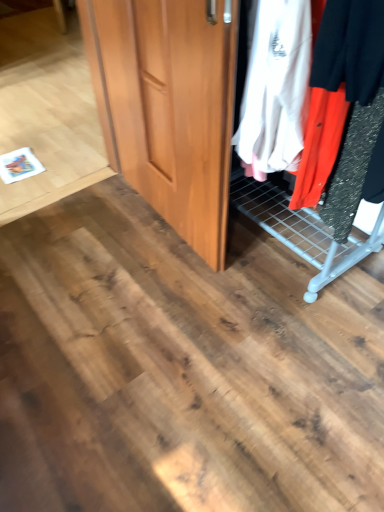
Question: From the image's perspective, is wooden wardrobe at center located above or below wooden door at center?

Choices:
 (A) below
 (B) above

Answer: (B)

Question: From a real-world perspective, is wooden wardrobe at center positioned above or below wooden door at center?

Choices:
 (A) above
 (B) below

Answer: (A)

Question: Considering the positions of wooden wardrobe at center and wooden door at center in the image, is wooden wardrobe at center wider or thinner than wooden door at center?

Choices:
 (A) wide
 (B) thin

Answer: (A)

Question: Is wooden door at center bigger or smaller than wooden wardrobe at center?

Choices:
 (A) small
 (B) big

Answer: (A)

Question: From a real-world perspective, is wooden door at center physically located above or below wooden wardrobe at center?

Choices:
 (A) above
 (B) below

Answer: (B)

Question: Considering the relative positions of wooden door at center and wooden wardrobe at center in the image provided, is wooden door at center to the left or to the right of wooden wardrobe at center?

Choices:
 (A) left
 (B) right

Answer: (A)

Question: Is wooden door at center wider or thinner than wooden wardrobe at center?

Choices:
 (A) thin
 (B) wide

Answer: (A)